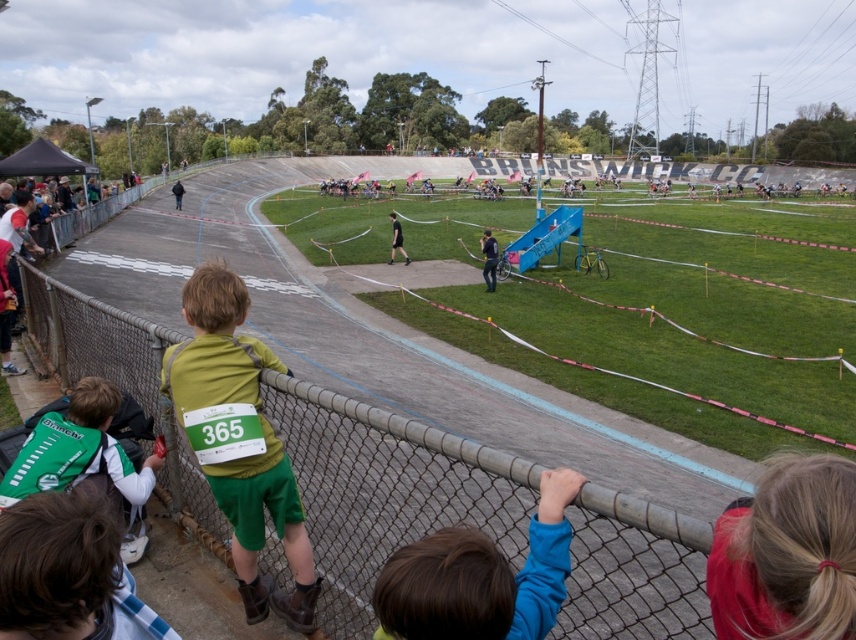
Based on the photo, you are standing at the point with coordinates point (174,193) and want to walk towards the point with coordinates point (117,442). Which direction should you move to get closer to your destination?

Since point (117,442) is closer to the viewer than point (174,193), you should move forward towards the direction where the point (117,442) is located to get closer to your destination.

You are a photographer at the event and want to capture a photo that includes both the green matte shorts at left and the black fabric shirt at center. Which object should be placed to the right in the frame?

The green matte shorts at left should be placed to the right in the frame because it is positioned on the right side of the black fabric shirt at center.